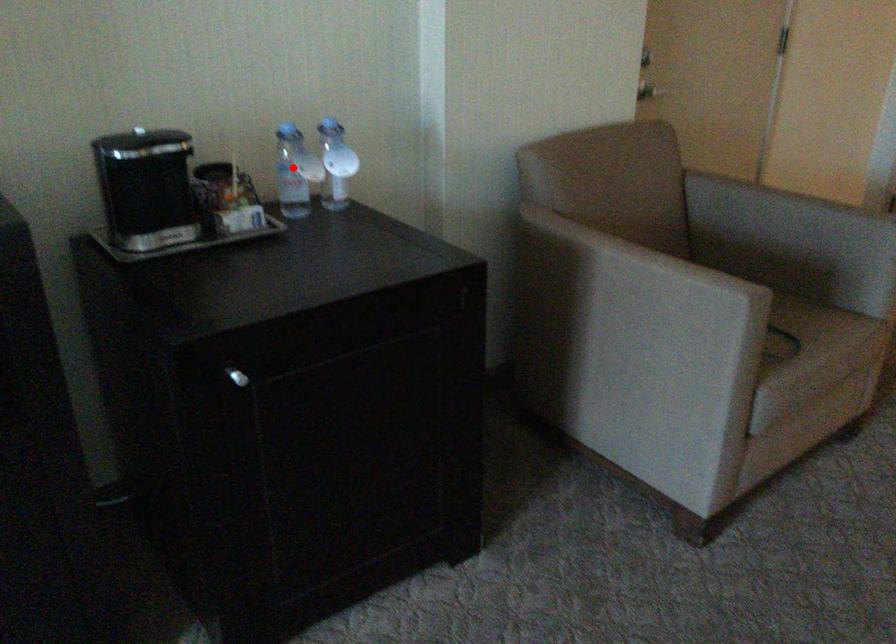
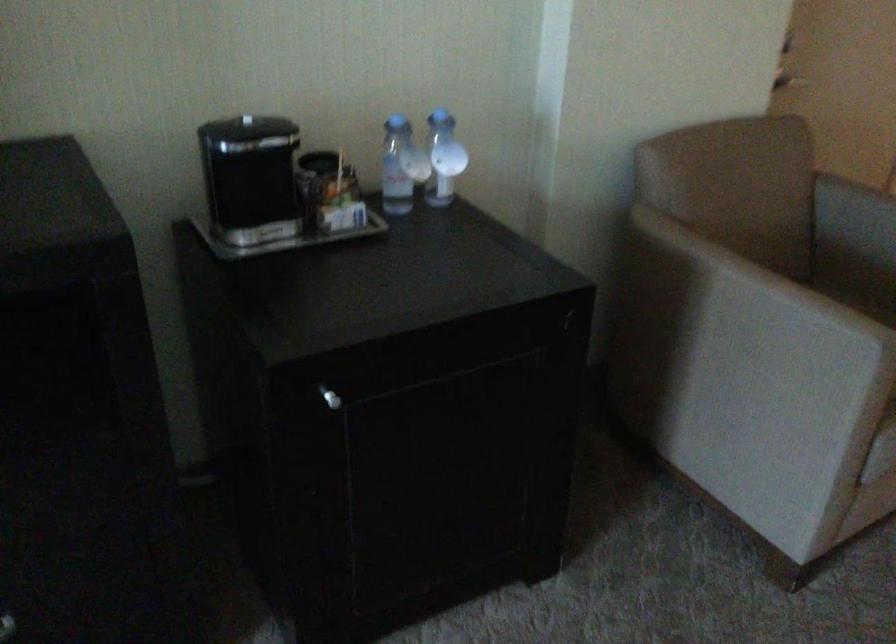
Where in the second image is the point corresponding to the highlighted location from the first image?

(401, 166)